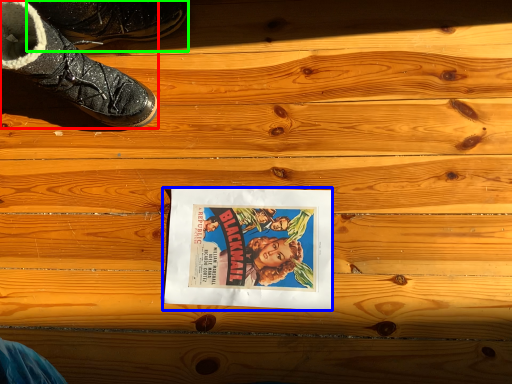
Question: Which object is the closest to the footwear (highlighted by a red box)? Choose among these: movie poster (highlighted by a blue box) or footwear (highlighted by a green box).

Choices:
 (A) movie poster
 (B) footwear

Answer: (B)